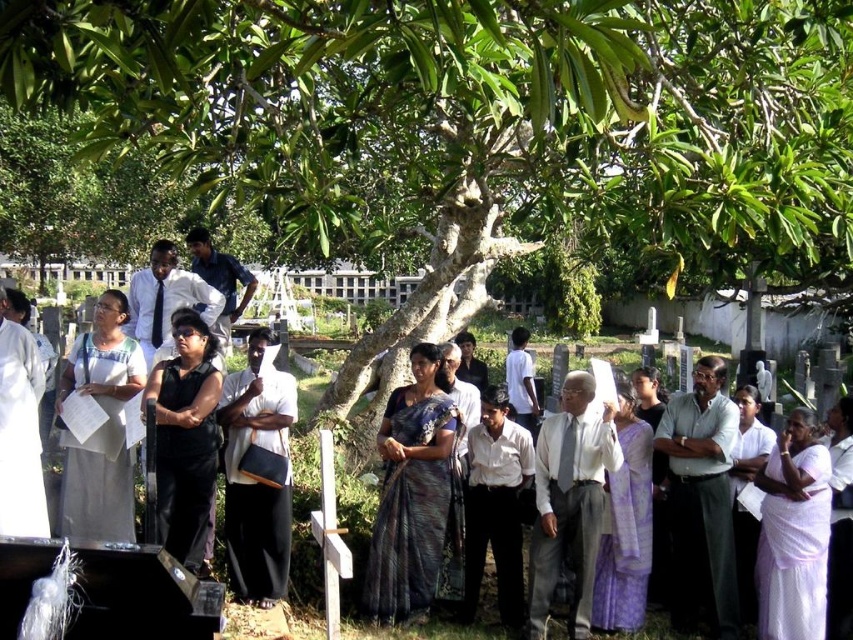
You are organizing a photo shoot and need to fit two models wearing the light gray shirt at center and the light gray fabric shirt at center side by side. Based on the image, which of the two shirts would require more space between the models?

The light gray fabric shirt at center requires more space because it has a greater width than the light gray shirt at center.

You are organizing a photo shoot and want to ensure all participants are visible in the group photo. Given the dark purple silk saree at center and dark blue shirt at center, which one takes up more space in the image?

The dark purple silk saree at center occupies less space than dark blue shirt at center, so the dark blue shirt at center takes up more space in the image.